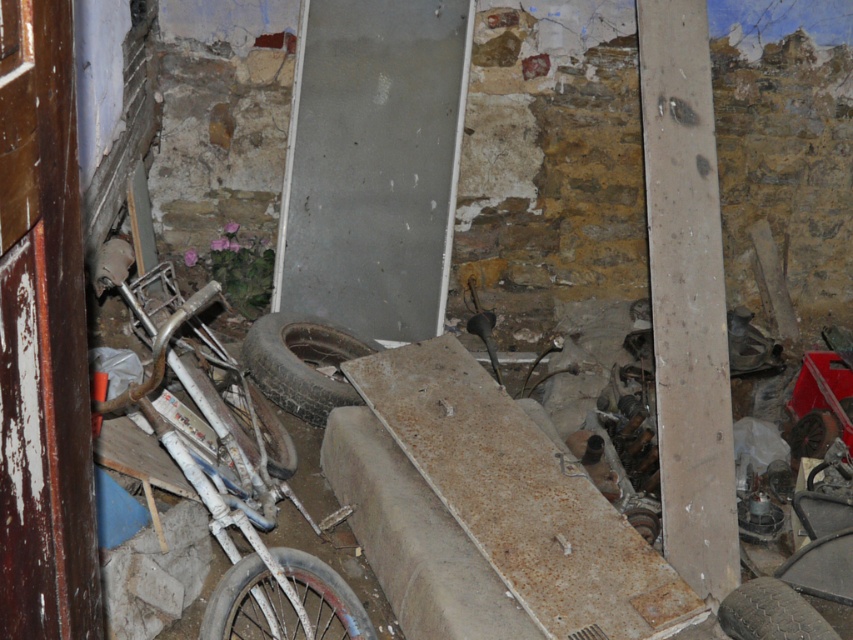
You are standing in the garage and need to locate the blue rubber tire at lower left. What are the coordinates where you should look?

The blue rubber tire at lower left is located at coordinates point (283, 602).